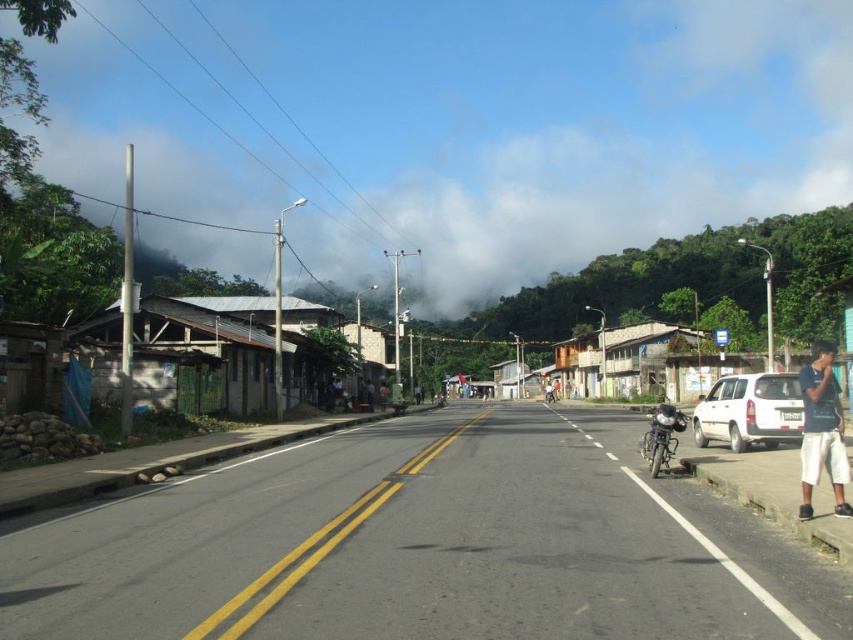
You are a pedestrian standing on the road in the image. You see a white matte suv at right and white cotton shorts at lower right. Which object is closer to you?

The white matte suv at right is closer to you than the white cotton shorts at lower right.